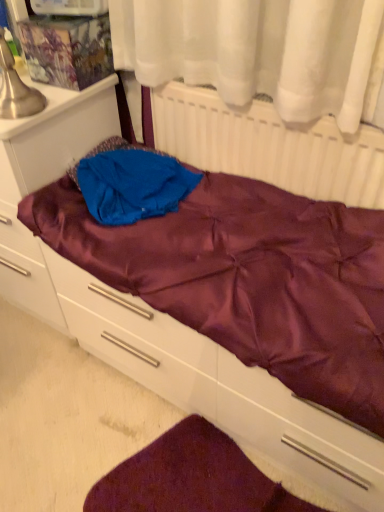
You are a GUI agent. You are given a task and a screenshot of the screen. Output one action in this format:
    pyautogui.click(x=<x>, y=<y>)
    Task: Click on the empty space that is ontop of white matte radiator at upper center (from a real-world perspective)
    This screenshot has width=384, height=512.
    Given the screenshot: What is the action you would take?
    pyautogui.click(x=254, y=97)